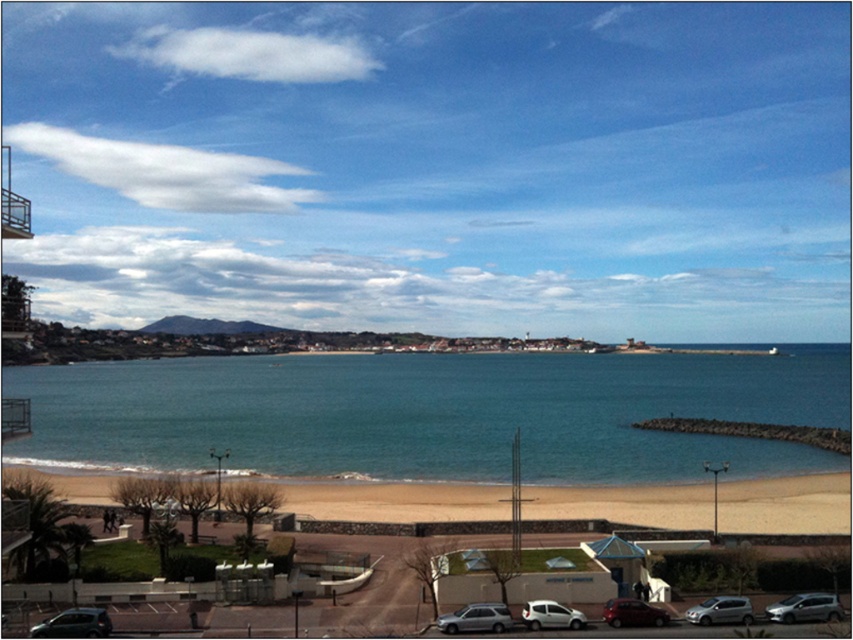
Question: Can you confirm if blue water at center is positioned to the right of silver metallic car at lower right?

Choices:
 (A) yes
 (B) no

Answer: (A)

Question: Can you confirm if shiny metallic car at lower left is bigger than white matte van at lower center?

Choices:
 (A) yes
 (B) no

Answer: (A)

Question: Which point is closer to the camera taking this photo?

Choices:
 (A) (701, 604)
 (B) (105, 628)
 (C) (636, 620)

Answer: (B)

Question: Which of the following is the closest to the observer?

Choices:
 (A) (621, 497)
 (B) (700, 612)
 (C) (769, 604)
 (D) (93, 614)

Answer: (D)

Question: Based on their relative distances, which object is farther from the white matte van at lower center?

Choices:
 (A) blue water at center
 (B) silver metallic car at lower center
 (C) silver metallic hatchback at lower right
 (D) shiny metallic car at lower left

Answer: (A)

Question: Is shiny metallic car at lower left below silver metallic car at lower center?

Choices:
 (A) no
 (B) yes

Answer: (A)